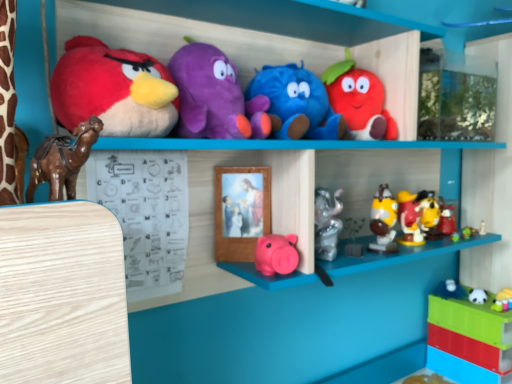
Where is `white plush panda at lower right, which ranks as the 3th toy in right-to-left order`? white plush panda at lower right, which ranks as the 3th toy in right-to-left order is located at coordinates [x=478, y=296].

What is the approximate width of wooden picture frame at center?

The width of wooden picture frame at center is 0.93 inches.

What do you see at coordinates (241, 212) in the screenshot? I see `wooden picture frame at center` at bounding box center [241, 212].

What do you see at coordinates (410, 219) in the screenshot? The width and height of the screenshot is (512, 384). I see `shiny plastic toys at center right, which ranks as the 5th toy in right-to-left order` at bounding box center [410, 219].

I want to click on matte plush bird at upper left, which is counted as the first toy, starting from the left, so pos(113,90).

Consider the image. Measure the distance between matte plush strawberry at upper center, which appears as the 5th toy when viewed from the left, and camera.

A distance of 35.24 inches exists between matte plush strawberry at upper center, which appears as the 5th toy when viewed from the left, and camera.

At what (x,y) coordinates should I click in order to perform the action: click on translucent plastic toy at lower right, which is the 10th toy from left to right. Please return your answer as a coordinate pair (x, y). Looking at the image, I should click on (468, 341).

The width and height of the screenshot is (512, 384). Describe the element at coordinates (503, 300) in the screenshot. I see `white glossy toy at lower right, arranged as the 11th toy when viewed from the left` at that location.

Locate an element on the screen. white glossy toy at lower right, arranged as the 11th toy when viewed from the left is located at coordinates (503, 300).

Locate an element on the screen. The width and height of the screenshot is (512, 384). white plush panda at lower right, positioned as the 9th toy in left-to-right order is located at coordinates [478, 296].

In terms of size, does fluffy purple plush at upper center, which is the second toy in left-to-right order, appear bigger or smaller than matte plush strawberry at upper center, which appears as the 5th toy when viewed from the left?

Considering their sizes, fluffy purple plush at upper center, which is the second toy in left-to-right order, takes up more space than matte plush strawberry at upper center, which appears as the 5th toy when viewed from the left.

At what (x,y) coordinates should I click in order to perform the action: click on toy that is the 1st one below the matte plush strawberry at upper center, which is counted as the seventh toy, starting from the right (from a real-world perspective). Please return your answer as a coordinate pair (x, y). Looking at the image, I should click on (212, 96).

Considering the sizes of objects fluffy purple plush at upper center, which is the second toy in left-to-right order, and matte plush strawberry at upper center, which is counted as the seventh toy, starting from the right, in the image provided, who is wider, fluffy purple plush at upper center, which is the second toy in left-to-right order, or matte plush strawberry at upper center, which is counted as the seventh toy, starting from the right,?

With larger width is fluffy purple plush at upper center, which is the second toy in left-to-right order.

Which object is more forward, fluffy purple plush at upper center, which is the second toy in left-to-right order, or matte plush strawberry at upper center, which appears as the 5th toy when viewed from the left?

Positioned in front is fluffy purple plush at upper center, which is the second toy in left-to-right order.

Which is in front, yellow matte figurine at right, which is the 4th toy in right-to-left order, or shiny plastic toys at center right, which ranks as the 5th toy in right-to-left order?

Positioned in front is shiny plastic toys at center right, which ranks as the 5th toy in right-to-left order.

From the yellow matte figurine at right, which is the 4th toy in right-to-left order, count the 1st toy to the left and point to it. Please provide its 2D coordinates.

[(410, 219)]

Which object is thinner, yellow matte figurine at right, which is the 4th toy in right-to-left order, or shiny plastic toys at center right, which ranks as the 5th toy in right-to-left order?

Answer: yellow matte figurine at right, which is the 4th toy in right-to-left order.

Would you say yellow matte figurine at right, the 8th toy positioned from the left, contains shiny plastic toys at center right, the 7th toy positioned from the left?

No, shiny plastic toys at center right, the 7th toy positioned from the left, is not inside yellow matte figurine at right, the 8th toy positioned from the left.

Is point (345, 95) positioned after point (205, 60)?

That is True.

Would you say matte plush strawberry at upper center, which is counted as the seventh toy, starting from the right, is outside fluffy purple plush at upper center, arranged as the tenth toy when viewed from the right?

Absolutely, matte plush strawberry at upper center, which is counted as the seventh toy, starting from the right, is external to fluffy purple plush at upper center, arranged as the tenth toy when viewed from the right.

From the image's perspective, would you say matte plush strawberry at upper center, which appears as the 5th toy when viewed from the left, is positioned over fluffy purple plush at upper center, arranged as the tenth toy when viewed from the right?

Indeed, from the image's perspective, matte plush strawberry at upper center, which appears as the 5th toy when viewed from the left, is shown above fluffy purple plush at upper center, arranged as the tenth toy when viewed from the right.

Could you tell me if matte plush strawberry at upper center, which is counted as the seventh toy, starting from the right, is turned towards fluffy purple plush at upper center, arranged as the tenth toy when viewed from the right?

No, matte plush strawberry at upper center, which is counted as the seventh toy, starting from the right, is not oriented towards fluffy purple plush at upper center, arranged as the tenth toy when viewed from the right.

Where is `the 2nd toy counting from the left of the blue plush toy at upper center, placed as the fourth toy when sorted from left to right`? The height and width of the screenshot is (384, 512). the 2nd toy counting from the left of the blue plush toy at upper center, placed as the fourth toy when sorted from left to right is located at coordinates (212, 96).

From the image's perspective, which is above, fluffy purple plush at upper center, which is the second toy in left-to-right order, or blue plush toy at upper center, marked as the 8th toy in a right-to-left arrangement?

fluffy purple plush at upper center, which is the second toy in left-to-right order, appears higher in the image.

Considering the points (189, 125) and (318, 130), which point is behind, point (189, 125) or point (318, 130)?

The point (318, 130) is farther.

Find the location of a particular element. This screenshot has width=512, height=384. the 4th toy positioned below the wooden picture frame at center (from a real-world perspective) is located at coordinates (276, 254).

Does matte plastic piggy bank at center, positioned as the 3th toy in left-to-right order, have a greater width compared to wooden picture frame at center?

Indeed, matte plastic piggy bank at center, positioned as the 3th toy in left-to-right order, has a greater width compared to wooden picture frame at center.

Who is more distant, matte plastic piggy bank at center, placed as the ninth toy when sorted from right to left, or wooden picture frame at center?

Positioned behind is wooden picture frame at center.

Is matte plastic piggy bank at center, positioned as the 3th toy in left-to-right order, facing away from wooden picture frame at center?

Yes, matte plastic piggy bank at center, positioned as the 3th toy in left-to-right order,'s orientation is away from wooden picture frame at center.

Which object is positioned more to the left, shiny plastic toys at center right, which ranks as the 5th toy in right-to-left order, or wooden picture frame at center?

Positioned to the left is wooden picture frame at center.

Between shiny plastic toys at center right, the 7th toy positioned from the left, and wooden picture frame at center, which one is positioned in front?

wooden picture frame at center is closer to the camera.

Looking at this image, from a real-world perspective, relative to wooden picture frame at center, is shiny plastic toys at center right, the 7th toy positioned from the left, vertically above or below?

shiny plastic toys at center right, the 7th toy positioned from the left, is below wooden picture frame at center.

From the image's perspective, is blue plush toy at upper center, marked as the 8th toy in a right-to-left arrangement, located beneath shiny plastic toys at center right, which ranks as the 5th toy in right-to-left order?

Actually, blue plush toy at upper center, marked as the 8th toy in a right-to-left arrangement, appears above shiny plastic toys at center right, which ranks as the 5th toy in right-to-left order, in the image.

In the scene shown: Is blue plush toy at upper center, marked as the 8th toy in a right-to-left arrangement, wider or thinner than shiny plastic toys at center right, the 7th toy positioned from the left?

Clearly, blue plush toy at upper center, marked as the 8th toy in a right-to-left arrangement, has more width compared to shiny plastic toys at center right, the 7th toy positioned from the left.

From a real-world perspective, who is located lower, blue plush toy at upper center, marked as the 8th toy in a right-to-left arrangement, or shiny plastic toys at center right, the 7th toy positioned from the left?

From a 3D spatial view, shiny plastic toys at center right, the 7th toy positioned from the left, is below.

Considering the relative sizes of blue plush toy at upper center, marked as the 8th toy in a right-to-left arrangement, and shiny plastic toys at center right, the 7th toy positioned from the left, in the image provided, is blue plush toy at upper center, marked as the 8th toy in a right-to-left arrangement, bigger than shiny plastic toys at center right, the 7th toy positioned from the left,?

Correct, blue plush toy at upper center, marked as the 8th toy in a right-to-left arrangement, is larger in size than shiny plastic toys at center right, the 7th toy positioned from the left.

Starting from the fluffy purple plush at upper center, arranged as the tenth toy when viewed from the right, which toy is the 3rd one to the right? Please provide its 2D coordinates.

[(359, 100)]

In order to click on toy that is the 1st one above the yellow matte figurine at right, which is the 4th toy in right-to-left order (from a real-world perspective) in this screenshot , I will do `click(410, 219)`.

From the image, which object appears to be nearer to fluffy purple plush at upper center, arranged as the tenth toy when viewed from the right, matte plush bird at upper left, which is counted as the first toy, starting from the left, or blue plush toy at upper center, marked as the 8th toy in a right-to-left arrangement?

blue plush toy at upper center, marked as the 8th toy in a right-to-left arrangement, is closer to fluffy purple plush at upper center, arranged as the tenth toy when viewed from the right.

Consider the image. Which object lies further to the anchor point white glossy toy at lower right, which is the first toy from right to left, translucent plastic toy at lower right, which is the 10th toy from left to right, or shiny plastic toys at center right, which ranks as the 5th toy in right-to-left order?

The object further to white glossy toy at lower right, which is the first toy from right to left, is shiny plastic toys at center right, which ranks as the 5th toy in right-to-left order.

Which object lies further to the anchor point shiny plastic toys at center right, the 7th toy positioned from the left, shiny plastic toys at center, which ranks as the 6th toy in right-to-left order, or matte plush strawberry at upper center, which is counted as the seventh toy, starting from the right?

matte plush strawberry at upper center, which is counted as the seventh toy, starting from the right, is further to shiny plastic toys at center right, the 7th toy positioned from the left.

Considering their positions, is yellow matte figurine at right, which is the 4th toy in right-to-left order, positioned further to matte plush bird at upper left, which is counted as the first toy, starting from the left, than white plush panda at lower right, positioned as the 9th toy in left-to-right order?

The object further to matte plush bird at upper left, which is counted as the first toy, starting from the left, is white plush panda at lower right, positioned as the 9th toy in left-to-right order.

Looking at the image, which one is located further to wooden picture frame at center, blue plush toy at upper center, marked as the 8th toy in a right-to-left arrangement, or matte plush strawberry at upper center, which is counted as the seventh toy, starting from the right?

Based on the image, matte plush strawberry at upper center, which is counted as the seventh toy, starting from the right, appears to be further to wooden picture frame at center.

Which object lies further to the anchor point translucent plastic toy at lower right, which is the 10th toy from left to right, blue plush toy at upper center, placed as the fourth toy when sorted from left to right, or matte plastic piggy bank at center, positioned as the 3th toy in left-to-right order?

blue plush toy at upper center, placed as the fourth toy when sorted from left to right, lies further to translucent plastic toy at lower right, which is the 10th toy from left to right, than the other object.

From the image, which object appears to be nearer to matte plush bird at upper left, the 11th toy viewed from the right, fluffy purple plush at upper center, arranged as the tenth toy when viewed from the right, or shiny plastic toys at center right, the 7th toy positioned from the left?

fluffy purple plush at upper center, arranged as the tenth toy when viewed from the right.

Estimate the real-world distances between objects in this image. Which object is closer to shiny plastic toys at center, which ranks as the 6th toy in right-to-left order, matte plush strawberry at upper center, which appears as the 5th toy when viewed from the left, or white glossy toy at lower right, which is the first toy from right to left?

Based on the image, matte plush strawberry at upper center, which appears as the 5th toy when viewed from the left, appears to be nearer to shiny plastic toys at center, which ranks as the 6th toy in right-to-left order.

The image size is (512, 384). In order to click on picture frame between fluffy purple plush at upper center, arranged as the tenth toy when viewed from the right, and matte plush strawberry at upper center, which is counted as the seventh toy, starting from the right, in the horizontal direction in this screenshot , I will do `click(241, 212)`.

Find the location of a particular element. picture frame between matte plush bird at upper left, which is counted as the first toy, starting from the left, and yellow matte figurine at right, which is the 4th toy in right-to-left order, in the horizontal direction is located at coordinates (241, 212).

You are a GUI agent. You are given a task and a screenshot of the screen. Output one action in this format:
    pyautogui.click(x=<x>, y=<y>)
    Task: Click on the picture frame between matte plush bird at upper left, the 11th toy viewed from the right, and white glossy toy at lower right, arranged as the 11th toy when viewed from the left
    The image size is (512, 384).
    Given the screenshot: What is the action you would take?
    pyautogui.click(x=241, y=212)

You are a GUI agent. You are given a task and a screenshot of the screen. Output one action in this format:
    pyautogui.click(x=<x>, y=<y>)
    Task: Click on the picture frame situated between matte plush bird at upper left, which is counted as the first toy, starting from the left, and matte plush strawberry at upper center, which is counted as the seventh toy, starting from the right, from left to right
    
    Given the screenshot: What is the action you would take?
    pyautogui.click(x=241, y=212)